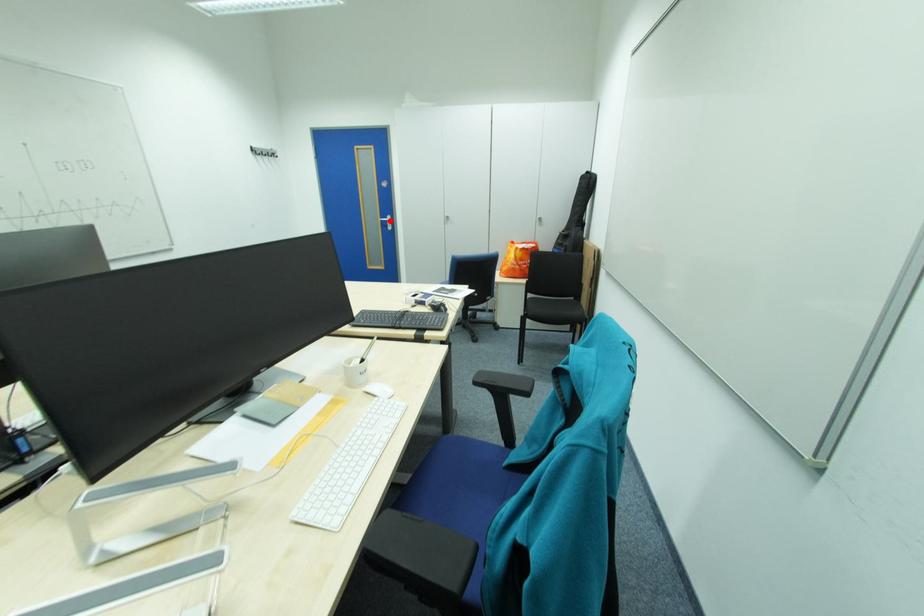
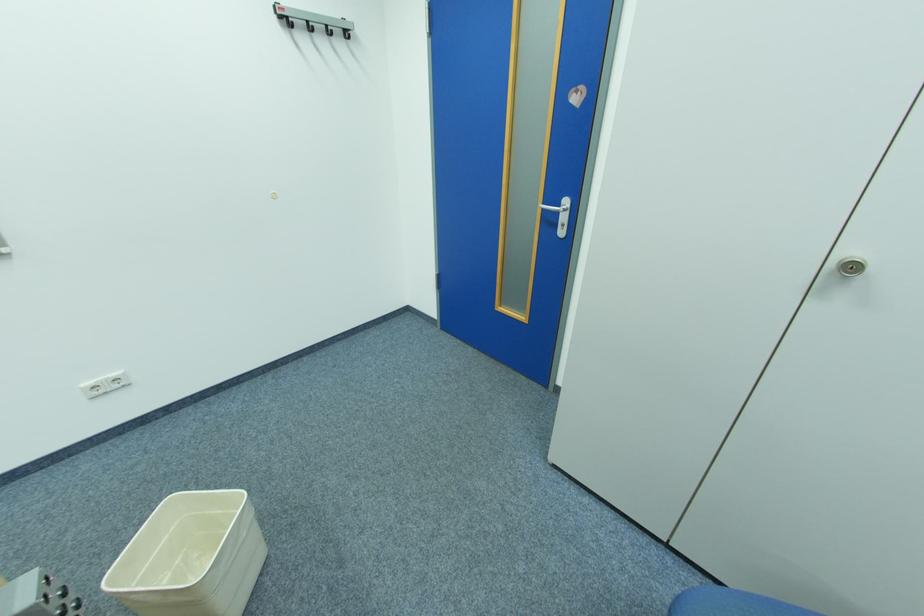
In the second image, find the point that corresponds to the highlighted location in the first image.

(552, 209)